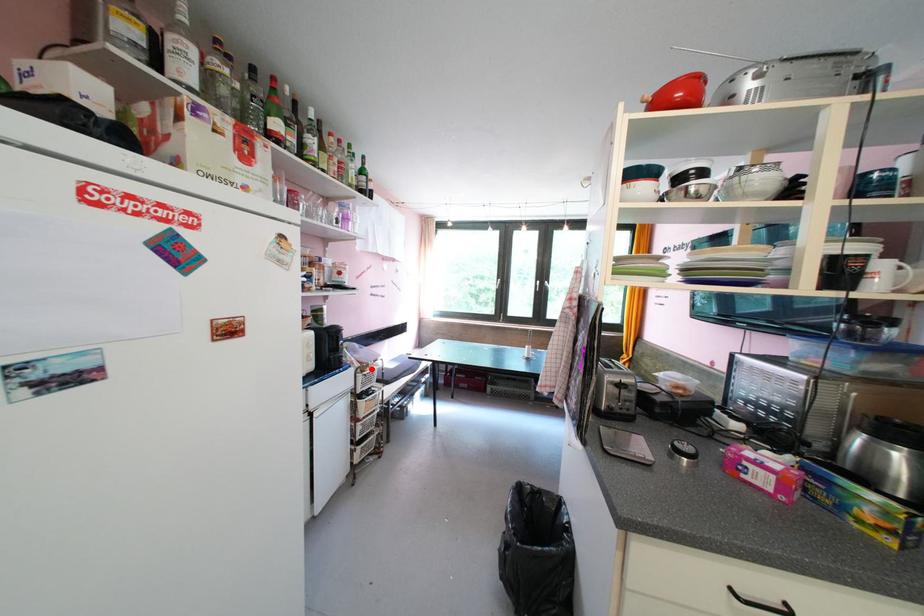
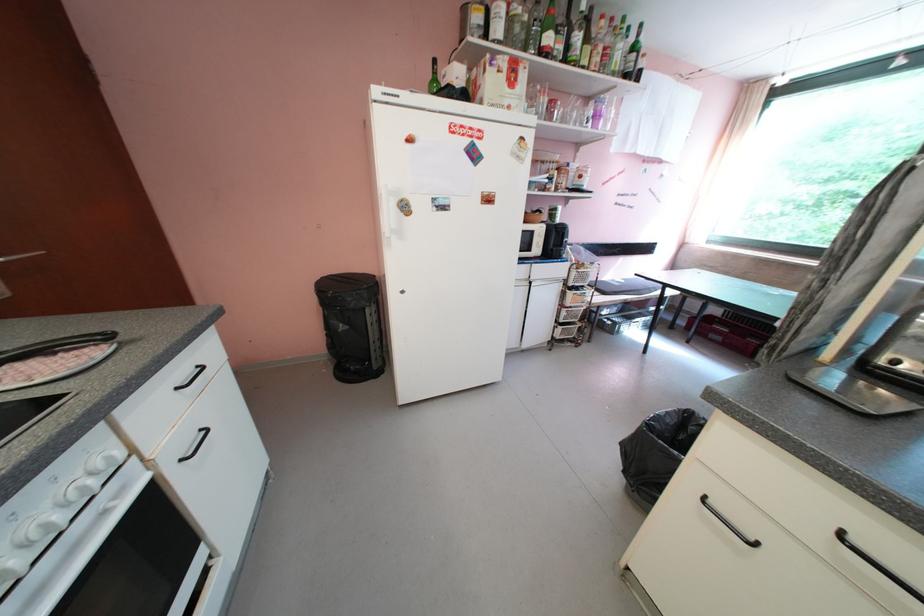
Find the pixel in the second image that matches the highlighted location in the first image.

(588, 268)